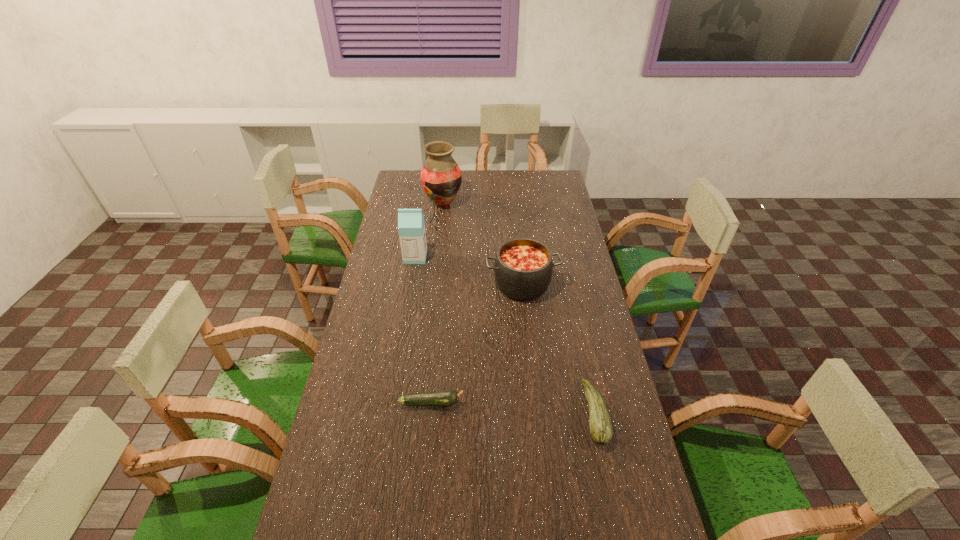
Image resolution: width=960 pixels, height=540 pixels. In order to click on vacant area that lies between the shortest object and the right zucchini in this screenshot , I will do `click(514, 408)`.

Where is `free area in between the third farthest object and the left zucchini`? This screenshot has height=540, width=960. free area in between the third farthest object and the left zucchini is located at coordinates (477, 343).

Image resolution: width=960 pixels, height=540 pixels. What are the coordinates of `vacant space in between the third tallest object and the farthest object` in the screenshot? It's located at (483, 244).

Identify the location of vacant space that is in between the farthest object and the third shortest object. (483, 244).

In order to click on free spot between the casserole and the fourth nearest object in this screenshot , I will do `click(468, 271)`.

Identify the location of vacant region between the fourth nearest object and the right zucchini. The height and width of the screenshot is (540, 960). (505, 335).

This screenshot has width=960, height=540. I want to click on object that is the fourth nearest to the fourth tallest object, so click(x=441, y=177).

At what (x,y) coordinates should I click in order to perform the action: click on object that can be found as the third closest to the left zucchini. Please return your answer as a coordinate pair (x, y). The width and height of the screenshot is (960, 540). Looking at the image, I should click on (411, 227).

Locate which zucchini ranks second in proximity to the third farthest object. Please provide its 2D coordinates. Your answer should be formatted as a tuple, i.e. [(x, y)], where the tuple contains the x and y coordinates of a point satisfying the conditions above.

[(447, 397)]